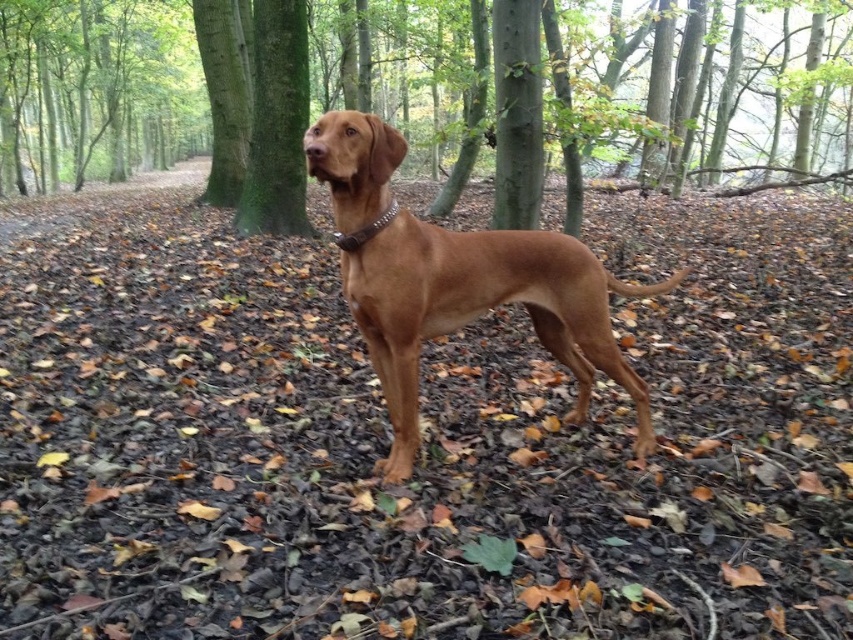
Question: Which object is the closest to the brown bark tree at center?

Choices:
 (A) brown leather dog at center
 (B) green mossy tree trunk at center

Answer: (B)

Question: Which point is closer to the camera?

Choices:
 (A) brown leather dog at center
 (B) green mossy tree trunk at center

Answer: (A)

Question: Which object appears closest to the camera in this image?

Choices:
 (A) brown leather dog at center
 (B) brown bark tree at center

Answer: (A)

Question: Is brown bark tree at center wider than brown leather dog at center?

Choices:
 (A) no
 (B) yes

Answer: (B)

Question: Considering the relative positions of brown leather dog at center and green mossy tree trunk at center in the image provided, where is brown leather dog at center located with respect to green mossy tree trunk at center?

Choices:
 (A) below
 (B) above

Answer: (A)

Question: Can you confirm if brown bark tree at center is positioned to the right of green mossy tree trunk at center?

Choices:
 (A) no
 (B) yes

Answer: (A)